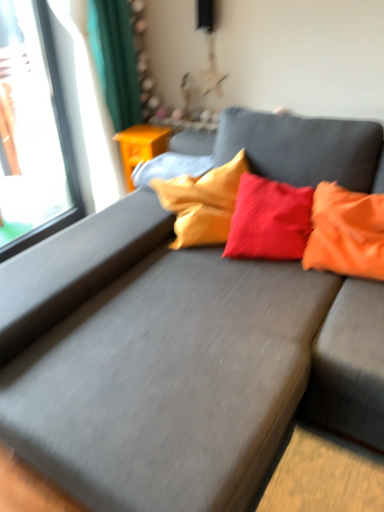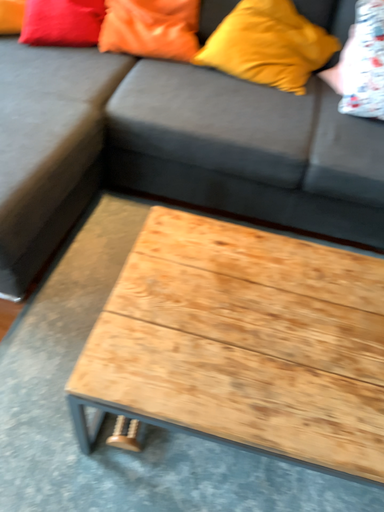
Question: How did the camera likely rotate when shooting the video?

Choices:
 (A) rotated downward
 (B) rotated upward

Answer: (A)